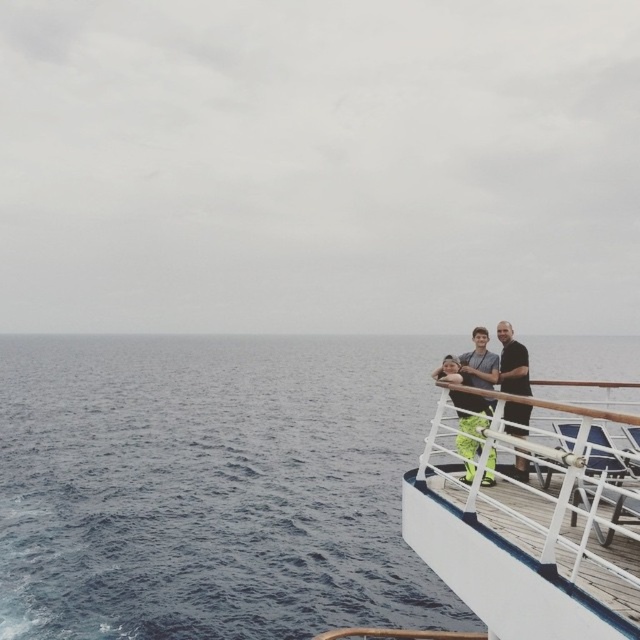
Question: Is white wooden deck at right above dark brown leather jacket at right?

Choices:
 (A) yes
 (B) no

Answer: (B)

Question: Can you confirm if dark blue shirt at right is bigger than dark brown leather jacket at right?

Choices:
 (A) yes
 (B) no

Answer: (B)

Question: Which of the following is the closest to the observer?

Choices:
 (A) (518, 372)
 (B) (209, 458)
 (C) (509, 378)

Answer: (A)

Question: Which of the following is the farthest from the observer?

Choices:
 (A) dark blue shirt at right
 (B) dark brown leather jacket at right

Answer: (A)

Question: Which of the following is the closest to the observer?

Choices:
 (A) dark blue shirt at right
 (B) neon green fabric at center
 (C) blue water at lower left

Answer: (A)

Question: Is blue water at lower left positioned in front of dark brown leather jacket at right?

Choices:
 (A) no
 (B) yes

Answer: (A)